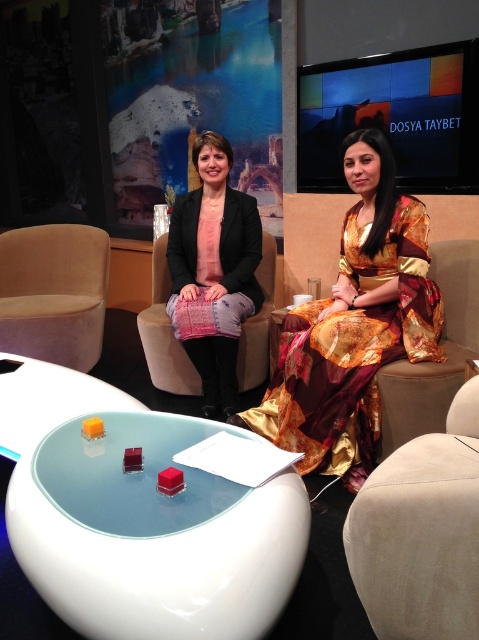
You are a costume designer preparing for a photoshoot. You need to place a 24 inch wide accessory between the gold satin dress at center and the matte black blazer at center. Will there be enough space to fit it between them?

The gold satin dress at center and the matte black blazer at center are 24.10 inches apart. Since the accessory is 24 inches wide, there will be just enough space to fit it between them with a small gap remaining.

You are a photographer setting up for a shoot in the studio. You need to position a light source above the gold satin dress at center and the black fabric armchair at center. Which object should you place the light closer to if you want the light to hit both objects equally?

The gold satin dress at center is located below the black fabric armchair at center. To ensure equal lighting, place the light source closer to the gold satin dress at center since it is lower and needs more light to reach both objects evenly.